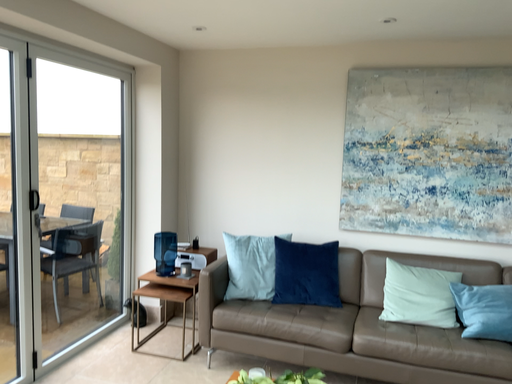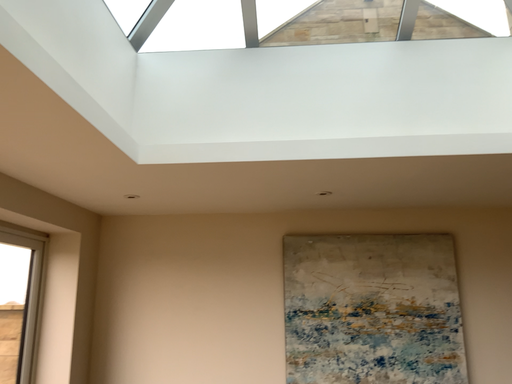
Question: Which way did the camera rotate in the video?

Choices:
 (A) rotated upward
 (B) rotated downward

Answer: (A)